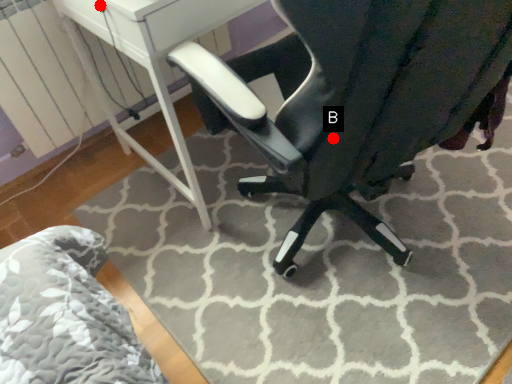
Question: Two points are circled on the image, labeled by A and B beside each circle. Which point is closer to the camera?

Choices:
 (A) A is closer
 (B) B is closer

Answer: (B)